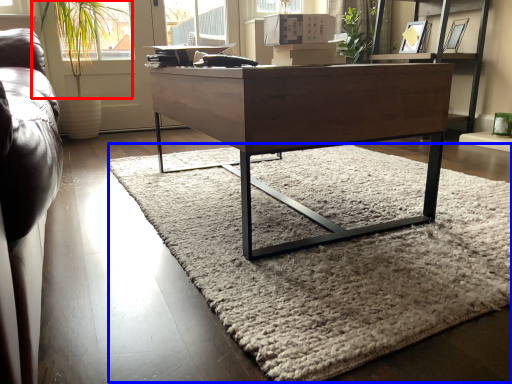
Question: Which object is further to the camera taking this photo, plant (highlighted by a red box) or mat (highlighted by a blue box)?

Choices:
 (A) plant
 (B) mat

Answer: (A)